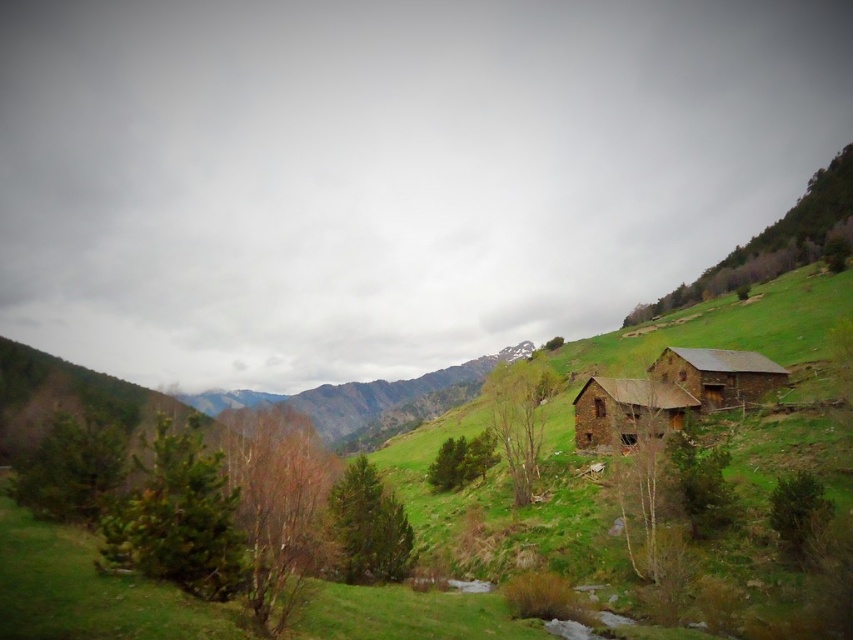
You are planning to build a new shed in your backyard and want to compare sizes. If the rustic stone hut at center is your current shed and the brown wooden hut at right is the proposed new shed, which one is wider?

The brown wooden hut at right is wider than the rustic stone hut at center.

You are standing at the base of the hill in the rural landscape and want to reach the rustic stone hut at center. According to the coordinates provided, in which direction should you head to find the shortest path towards the hut?

The rustic stone hut at center is located at point 0.644 on the x and 0.735 on the y coordinate. Since you are at the base of the hill, heading towards the center coordinates would mean moving uphill in the direction of the hut.